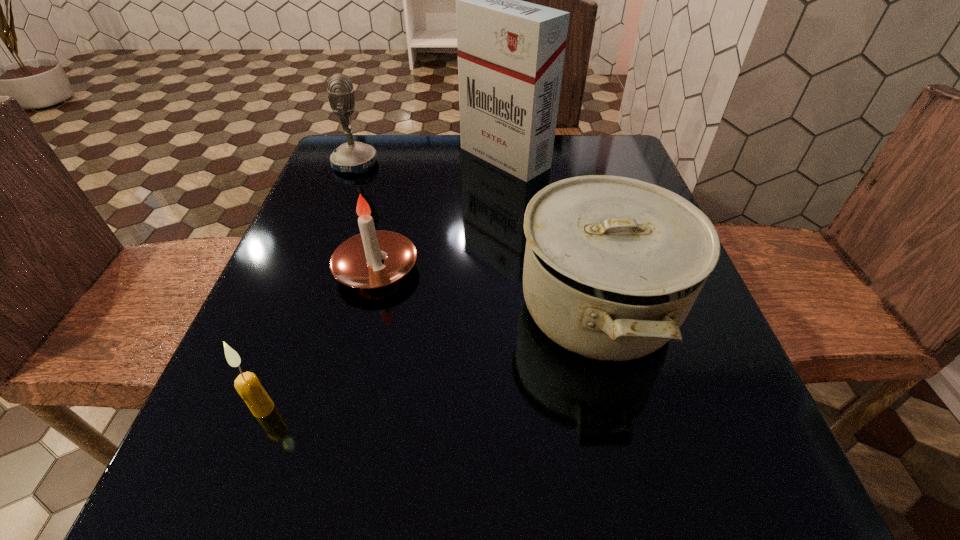
Point out which object is positioned as the nearest to the nearer candle. Please provide its 2D coordinates. Your answer should be formatted as a tuple, i.e. [(x, y)], where the tuple contains the x and y coordinates of a point satisfying the conditions above.

[(356, 262)]

Select which object is the second closest to the microphone. Please provide its 2D coordinates. Your answer should be formatted as a tuple, i.e. [(x, y)], where the tuple contains the x and y coordinates of a point satisfying the conditions above.

[(356, 262)]

I want to click on free spot that satisfies the following two spatial constraints: 1. on the back side of the tallest object; 2. on the right side of the farther candle, so click(x=403, y=158).

This screenshot has width=960, height=540. I want to click on free spot that satisfies the following two spatial constraints: 1. on the back side of the tallest object; 2. on the left side of the right candle, so click(x=403, y=158).

Locate an element on the screen. Image resolution: width=960 pixels, height=540 pixels. free space in the image that satisfies the following two spatial constraints: 1. on the front-facing side of the microphone; 2. on the right side of the right candle is located at coordinates (316, 269).

I want to click on vacant area in the image that satisfies the following two spatial constraints: 1. on the front-facing side of the right candle; 2. on the right side of the microphone, so click(x=316, y=269).

Locate an element on the screen. free space that satisfies the following two spatial constraints: 1. on the front side of the cigarette case; 2. on the front-facing side of the microphone is located at coordinates (505, 164).

This screenshot has height=540, width=960. In order to click on blank space that satisfies the following two spatial constraints: 1. on the front-facing side of the saucepan; 2. on the right side of the microphone in this screenshot , I will do `click(301, 307)`.

This screenshot has height=540, width=960. I want to click on vacant space that satisfies the following two spatial constraints: 1. on the front side of the cigarette case; 2. on the front-facing side of the microphone, so click(505, 164).

This screenshot has width=960, height=540. Find the location of `free space that satisfies the following two spatial constraints: 1. on the front-facing side of the microphone; 2. on the right side of the nearer candle`. free space that satisfies the following two spatial constraints: 1. on the front-facing side of the microphone; 2. on the right side of the nearer candle is located at coordinates (262, 408).